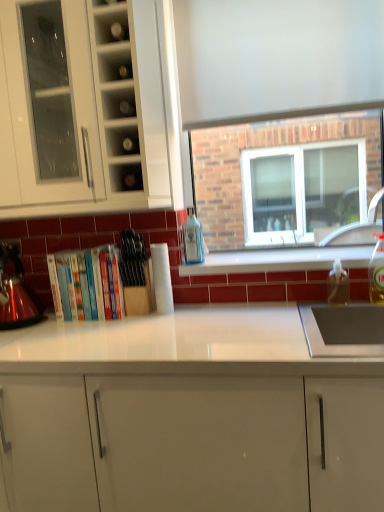
Question: Which direction should I rotate to look at blue glass bottle at center, placed as the 1th bottle when sorted from back to front, — up or down?

Choices:
 (A) up
 (B) down

Answer: (A)

Question: Is hardcover books at center outside of clear plastic bottle at right, the third bottle in the left-to-right sequence?

Choices:
 (A) no
 (B) yes

Answer: (B)

Question: Considering the relative sizes of hardcover books at center and clear plastic bottle at right, the first bottle from the front, in the image provided, is hardcover books at center wider than clear plastic bottle at right, the first bottle from the front,?

Choices:
 (A) no
 (B) yes

Answer: (B)

Question: Does hardcover books at center have a larger size compared to clear plastic bottle at right, acting as the first bottle starting from the right?

Choices:
 (A) no
 (B) yes

Answer: (B)

Question: Is hardcover books at center far away from clear plastic bottle at right, the first bottle from the front?

Choices:
 (A) no
 (B) yes

Answer: (B)

Question: Can you confirm if hardcover books at center is shorter than clear plastic bottle at right, the first bottle from the front?

Choices:
 (A) yes
 (B) no

Answer: (B)

Question: From a real-world perspective, is hardcover books at center located beneath clear plastic bottle at right, the third bottle in the left-to-right sequence?

Choices:
 (A) no
 (B) yes

Answer: (A)

Question: Can you confirm if white glossy cabinet at upper left, the 2th cabinetry positioned from the bottom, is thinner than white glossy window sill at center?

Choices:
 (A) no
 (B) yes

Answer: (A)

Question: Is white glossy cabinet at upper left, the 2th cabinetry positioned from the bottom, taller than white glossy window sill at center?

Choices:
 (A) yes
 (B) no

Answer: (A)

Question: From the image's perspective, is white glossy cabinet at upper left, which is the first cabinetry from top to bottom, located above white glossy window sill at center?

Choices:
 (A) no
 (B) yes

Answer: (B)

Question: Is white glossy cabinet at upper left, which is the first cabinetry from top to bottom, completely or partially outside of white glossy window sill at center?

Choices:
 (A) yes
 (B) no

Answer: (A)

Question: From the image's perspective, does white glossy cabinet at upper left, the 2th cabinetry positioned from the bottom, appear lower than white glossy window sill at center?

Choices:
 (A) no
 (B) yes

Answer: (A)

Question: From a real-world perspective, is white glossy cabinet at upper left, the 2th cabinetry positioned from the bottom, located beneath white glossy window sill at center?

Choices:
 (A) no
 (B) yes

Answer: (A)

Question: Is hardcover books at center further to the viewer compared to clear glass shelf at upper center, which ranks as the first shelf in top-to-bottom order?

Choices:
 (A) yes
 (B) no

Answer: (A)